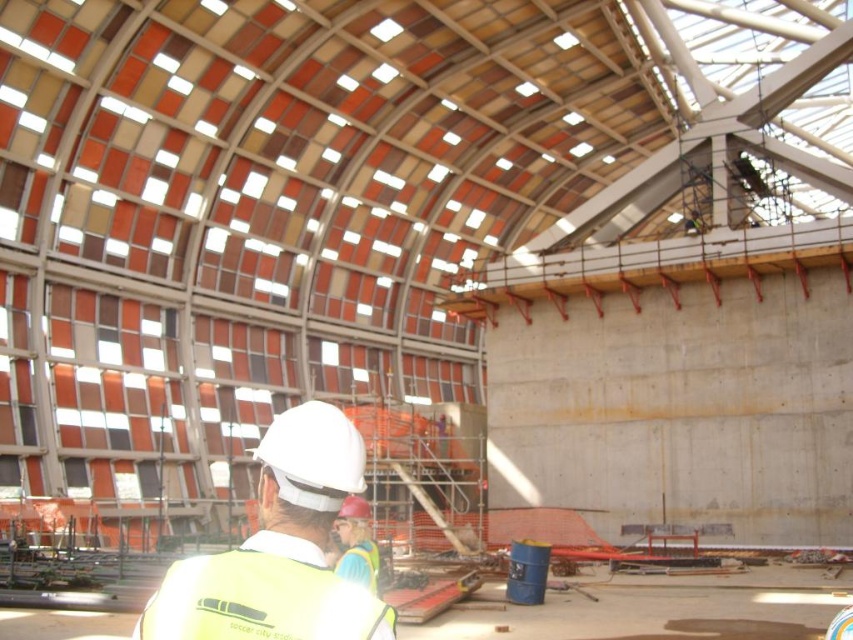
You are a construction worker standing at the center of the unfinished structure. You notice a yellow reflective vest at center. Where is the point at coordinate (279, 548) located?

The point at coordinate (279, 548) is located on the yellow reflective vest at center.

You are standing at the entrance of the unfinished structure and see two points marked on the floor. The first point is at coordinates point (x=271, y=545) and the second is at point (x=323, y=625). Which point is closer to the entrance?

Point (x=323, y=625) is closer to the entrance because point (x=271, y=545) is behind it.

You are a construction worker in the unfinished building. You see the yellow reflective vest at center and the yellow reflective safety vest at lower left. Which one is closer to you?

The yellow reflective vest at center is closer to you because the yellow reflective safety vest at lower left is behind it.